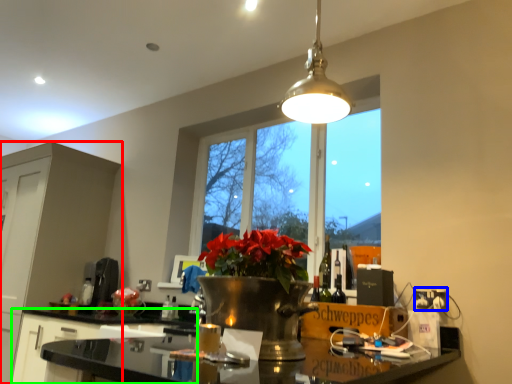
Question: Considering the real-world distances, which object is farthest from cabinetry (highlighted by a red box)? electric outlet (highlighted by a blue box) or cabinetry (highlighted by a green box)?

Choices:
 (A) electric outlet
 (B) cabinetry

Answer: (A)